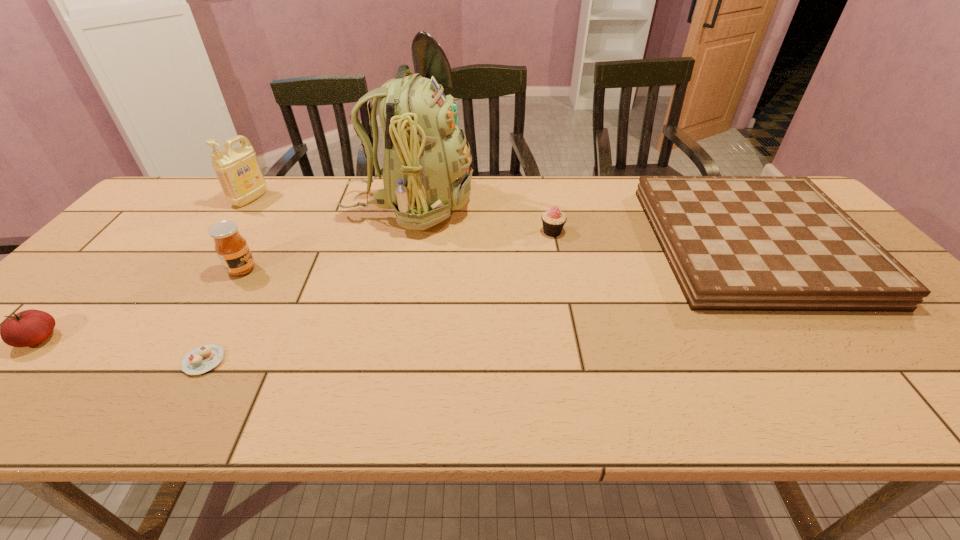
You are a GUI agent. You are given a task and a screenshot of the screen. Output one action in this format:
    pyautogui.click(x=<x>, y=<y>)
    Task: Click on the fifth object from left to right
    
    Given the screenshot: What is the action you would take?
    pyautogui.click(x=426, y=174)

Identify the location of the tallest object. (426, 174).

This screenshot has width=960, height=540. I want to click on detergent, so click(238, 171).

Locate an element on the screen. This screenshot has width=960, height=540. the sixth shortest object is located at coordinates (238, 171).

Find the location of a particular element. the third tallest object is located at coordinates (232, 249).

This screenshot has width=960, height=540. I want to click on the sixth object from left to right, so (553, 220).

Identify the location of the right cupcake. This screenshot has height=540, width=960. (553, 220).

This screenshot has height=540, width=960. In order to click on the leftmost object in this screenshot , I will do [30, 327].

The image size is (960, 540). Find the location of `the sixth tallest object`. the sixth tallest object is located at coordinates (734, 243).

Where is `gameboard`? This screenshot has width=960, height=540. gameboard is located at coordinates (734, 243).